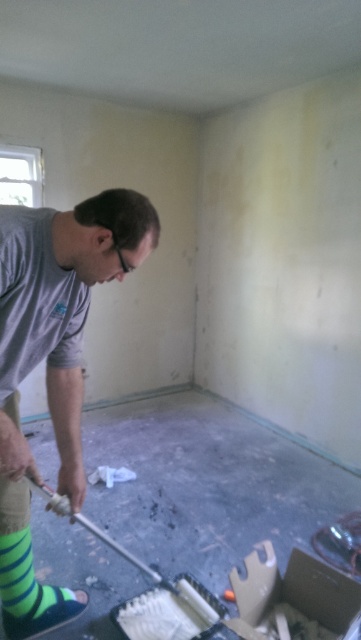
Question: Is gray cotton shirt at center smaller than green striped sock at lower left?

Choices:
 (A) yes
 (B) no

Answer: (B)

Question: Among these points, which one is farthest from the camera?

Choices:
 (A) (28, 595)
 (B) (15, 490)

Answer: (A)

Question: Is gray cotton shirt at center to the right of green striped sock at lower left from the viewer's perspective?

Choices:
 (A) yes
 (B) no

Answer: (A)

Question: Which point is closer to the camera taking this photo?

Choices:
 (A) (58, 429)
 (B) (29, 531)

Answer: (A)

Question: Which object appears farthest from the camera in this image?

Choices:
 (A) green striped sock at lower left
 (B) gray cotton shirt at center

Answer: (A)

Question: Does gray cotton shirt at center have a larger size compared to green striped sock at lower left?

Choices:
 (A) yes
 (B) no

Answer: (A)